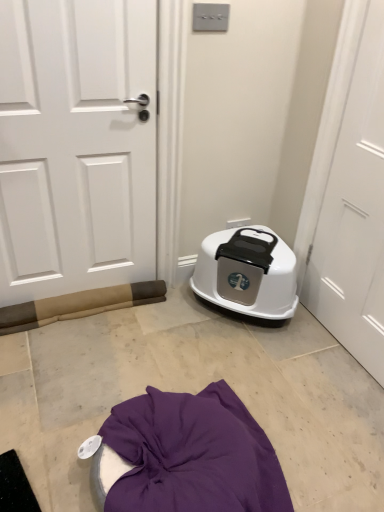
Identify the location of free space between white matte door at left, acting as the second door starting from the right, and white matte door at right, arranged as the second door when viewed from the left. This screenshot has width=384, height=512. (215, 342).